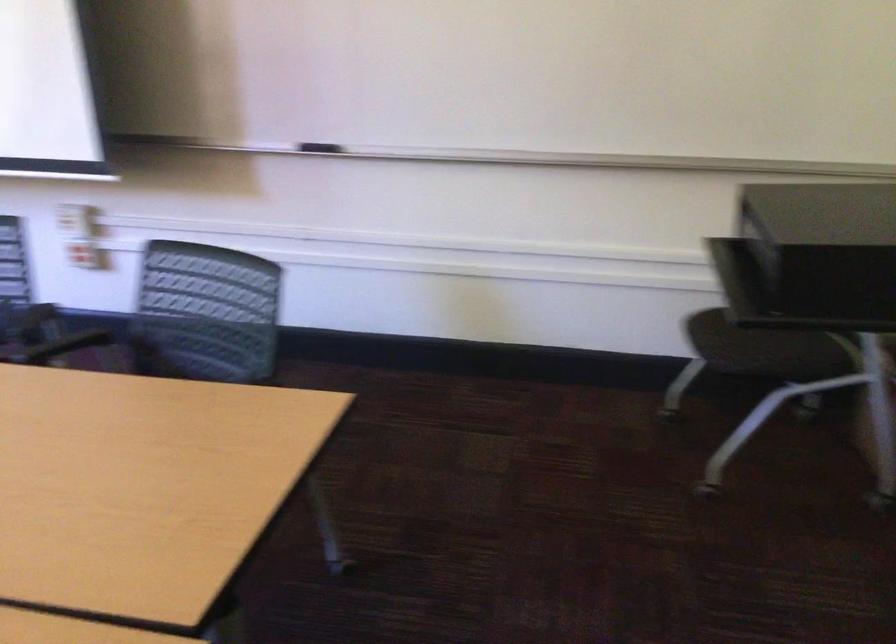
Find the location of a particular element. The image size is (896, 644). black chair armrest is located at coordinates (71, 336).